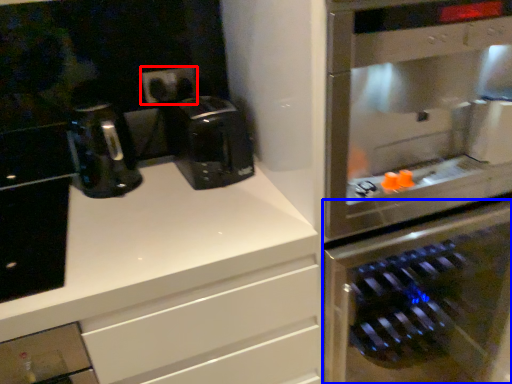
Question: Which object appears closest to the camera in this image, electric outlet (highlighted by a red box) or oven (highlighted by a blue box)?

Choices:
 (A) electric outlet
 (B) oven

Answer: (B)